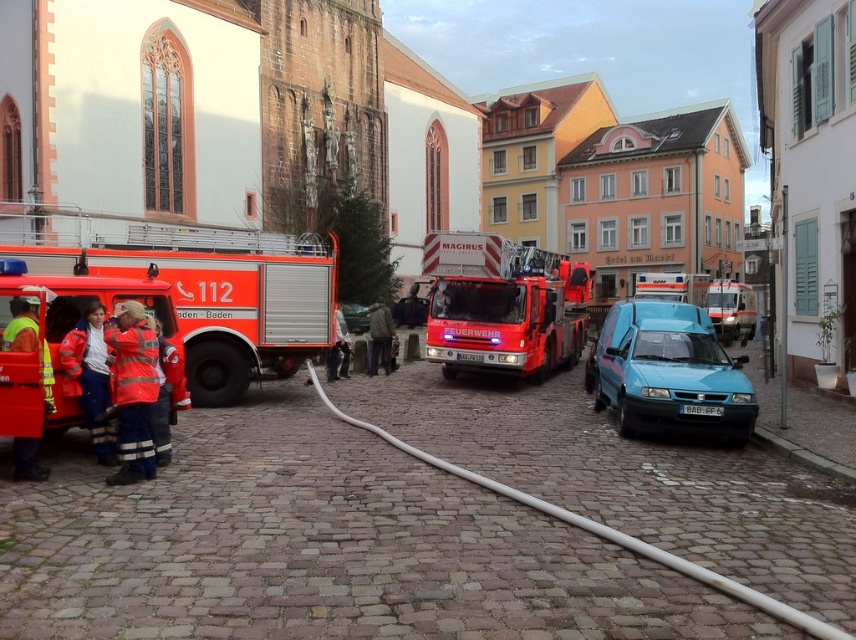
You are a delivery driver who needs to park your truck between the blue matte van at center and the red glossy fire truck at center in the town square. The length of your truck is 20 feet. Can you fit your truck between them without overlapping either vehicle?

The blue matte van at center and red glossy fire truck at center are 58.51 feet apart. Since your truck is only 20 feet long, there is sufficient space to park between them without overlapping either vehicle.

You are a delivery person who needs to park your 2.5m tall truck. You see the blue matte van at center and the red glossy fire truck at center in the square. Which vehicle should you park next to if you want to avoid blocking the road due to height restrictions?

The blue matte van at center has a lesser height compared to the red glossy fire truck at center, so you should park next to the blue matte van at center to avoid blocking the road due to height restrictions.

You are a town planner assessing emergency vehicle access. You need to know which fire truck has a larger size between the orange glossy fire truck at left and the metallic silver fire truck at center to determine parking space requirements. Which one is bigger?

The orange glossy fire truck at left is bigger than the metallic silver fire truck at center, so it requires more parking space.